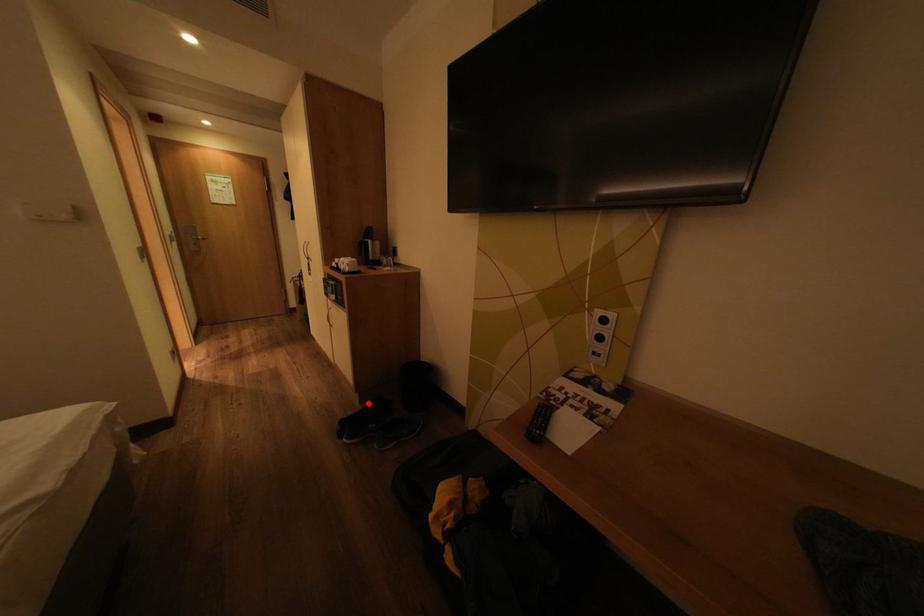
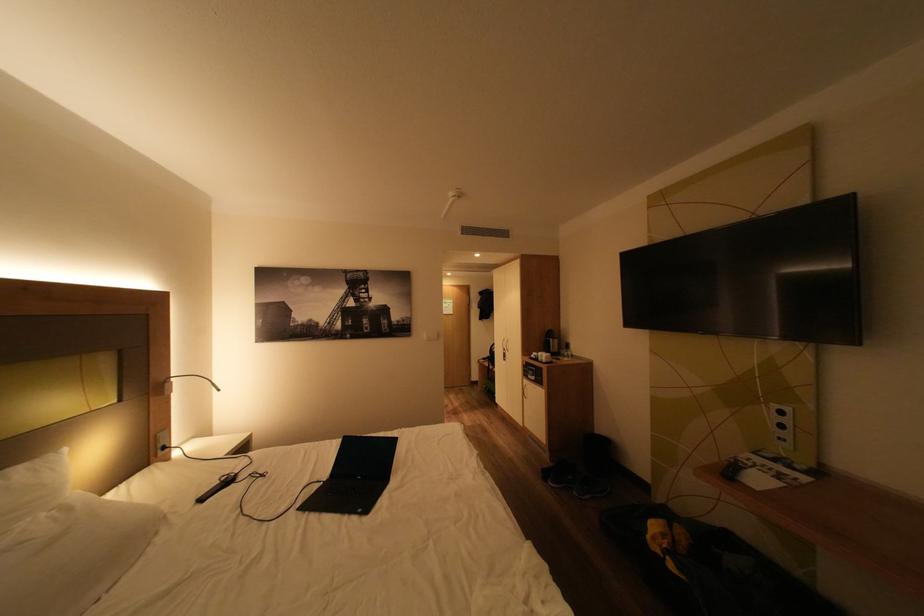
Question: I am providing you with two images of the same scene from different viewpoints. Given a red point in image1, look at the same physical point in image2. Is it:

Choices:
 (A) Closer to the viewpoint
 (B) Farther from the viewpoint

Answer: (B)